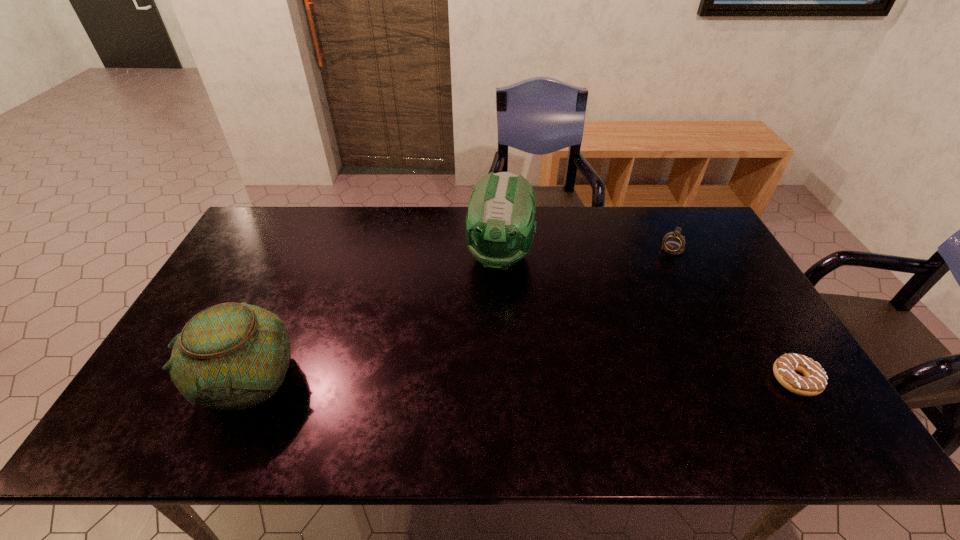
Locate an element on the screen. vacant region located 0.290m on the face of the compass is located at coordinates (636, 311).

What are the coordinates of `vacant position located on the face of the compass` in the screenshot? It's located at (622, 333).

The image size is (960, 540). I want to click on vacant space located on the face of the compass, so click(x=645, y=294).

The image size is (960, 540). Identify the location of vacant space located on the visor of the second object from left to right. (477, 369).

You are a GUI agent. You are given a task and a screenshot of the screen. Output one action in this format:
    pyautogui.click(x=<x>, y=<y>)
    Task: Click on the vacant space located 0.260m on the visor of the second object from left to right
    The height and width of the screenshot is (540, 960).
    Given the screenshot: What is the action you would take?
    pyautogui.click(x=481, y=353)

I want to click on free spot located on the visor of the second object from left to right, so click(476, 372).

Where is `compass positioned at the far edge`? The height and width of the screenshot is (540, 960). compass positioned at the far edge is located at coordinates (673, 243).

You are a GUI agent. You are given a task and a screenshot of the screen. Output one action in this format:
    pyautogui.click(x=<x>, y=<y>)
    Task: Click on the football helmet that is at the far edge
    
    Given the screenshot: What is the action you would take?
    pyautogui.click(x=499, y=230)

The width and height of the screenshot is (960, 540). What are the coordinates of `pottery that is at the near edge` in the screenshot? It's located at (231, 356).

The height and width of the screenshot is (540, 960). What are the coordinates of `doughnut positioned at the near edge` in the screenshot? It's located at (814, 382).